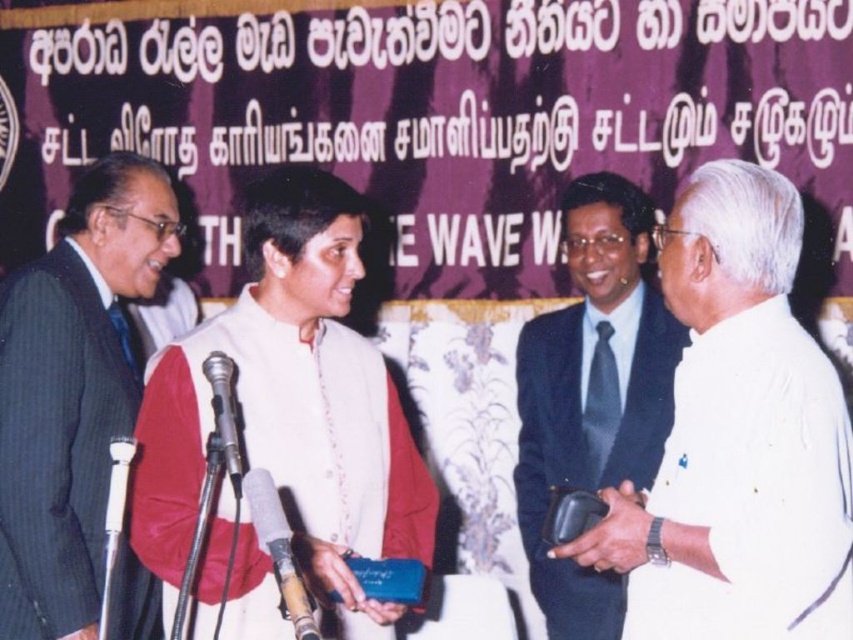
Question: Which point appears farthest from the camera in this image?

Choices:
 (A) (230, 474)
 (B) (112, 493)
 (C) (172, 236)

Answer: (C)

Question: Among these objects, which one is nearest to the camera?

Choices:
 (A) white matte shirt at right
 (B) white matte vest at center
 (C) metallic silver microphone at lower center
 (D) dark gray suit at left

Answer: (A)

Question: Can you confirm if dark blue suit at right is thinner than white plastic microphone at left?

Choices:
 (A) yes
 (B) no

Answer: (B)

Question: Which object is positioned farthest from the metallic silver microphone at lower center?

Choices:
 (A) silver metallic microphone at center
 (B) dark blue suit at right
 (C) white plastic microphone at left

Answer: (B)

Question: Does white matte vest at center have a greater width compared to metallic silver microphone at lower center?

Choices:
 (A) no
 (B) yes

Answer: (B)

Question: Is white matte shirt at right thinner than metallic silver microphone at lower center?

Choices:
 (A) no
 (B) yes

Answer: (A)